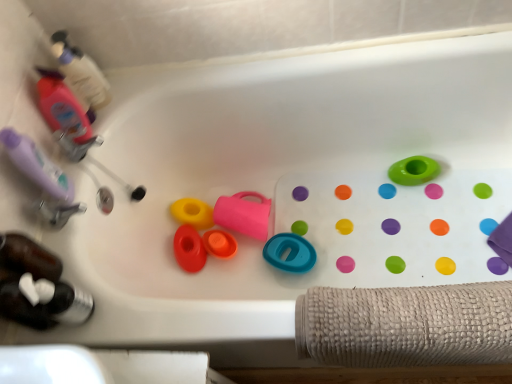
Question: From a real-world perspective, does orange matte cup at center, which appears as the third toy when viewed from the left, sit lower than beige textured towel at lower right?

Choices:
 (A) yes
 (B) no

Answer: (A)

Question: From a real-world perspective, is orange matte cup at center, which appears as the third toy when viewed from the left, located higher than beige textured towel at lower right?

Choices:
 (A) yes
 (B) no

Answer: (B)

Question: Is orange matte cup at center, which appears as the third toy when viewed from the left, positioned beyond the bounds of beige textured towel at lower right?

Choices:
 (A) no
 (B) yes

Answer: (B)

Question: From the image's perspective, does orange matte cup at center, which appears as the third toy when viewed from the left, appear higher than beige textured towel at lower right?

Choices:
 (A) yes
 (B) no

Answer: (A)

Question: Can you confirm if orange matte cup at center, which is the fourth toy in right-to-left order, is shorter than beige textured towel at lower right?

Choices:
 (A) no
 (B) yes

Answer: (B)

Question: Can you confirm if orange matte cup at center, which appears as the third toy when viewed from the left, is taller than beige textured towel at lower right?

Choices:
 (A) no
 (B) yes

Answer: (A)

Question: Considering the relative sizes of purple matte bottle at left and teal rubber ring at center, which is the fifth toy in left-to-right order, in the image provided, is purple matte bottle at left thinner than teal rubber ring at center, which is the fifth toy in left-to-right order,?

Choices:
 (A) no
 (B) yes

Answer: (B)

Question: Is teal rubber ring at center, which is the second toy in right-to-left order, located within purple matte bottle at left?

Choices:
 (A) yes
 (B) no

Answer: (B)

Question: Is purple matte bottle at left positioned with its back to teal rubber ring at center, which is the fifth toy in left-to-right order?

Choices:
 (A) yes
 (B) no

Answer: (B)

Question: Is purple matte bottle at left at the left side of teal rubber ring at center, which is the fifth toy in left-to-right order?

Choices:
 (A) no
 (B) yes

Answer: (B)

Question: Considering the relative positions of purple matte bottle at left and teal rubber ring at center, which is the fifth toy in left-to-right order, in the image provided, is purple matte bottle at left to the right of teal rubber ring at center, which is the fifth toy in left-to-right order, from the viewer's perspective?

Choices:
 (A) yes
 (B) no

Answer: (B)

Question: From the image's perspective, is purple matte bottle at left on top of teal rubber ring at center, which is the second toy in right-to-left order?

Choices:
 (A) no
 (B) yes

Answer: (B)

Question: Considering the relative sizes of green rubber ring at upper right, positioned as the sixth toy in left-to-right order, and yellow rubber toy at center, placed as the 5th toy when sorted from right to left, in the image provided, is green rubber ring at upper right, positioned as the sixth toy in left-to-right order, wider than yellow rubber toy at center, placed as the 5th toy when sorted from right to left,?

Choices:
 (A) yes
 (B) no

Answer: (B)